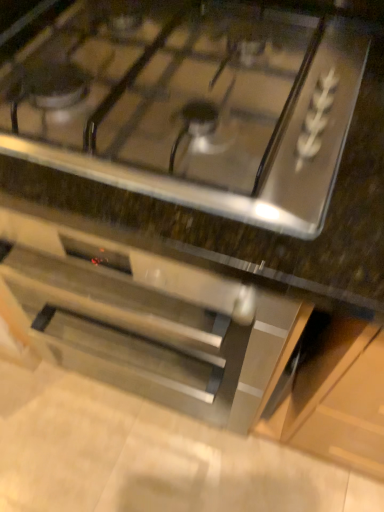
What do you see at coordinates (193, 108) in the screenshot? This screenshot has width=384, height=512. I see `satin black gas stove at upper center` at bounding box center [193, 108].

What are the coordinates of `satin black gas stove at upper center` in the screenshot? It's located at (193, 108).

At what (x,y) coordinates should I click in order to perform the action: click on satin black gas stove at upper center. Please return your answer as a coordinate pair (x, y). Image resolution: width=384 pixels, height=512 pixels. Looking at the image, I should click on (193, 108).